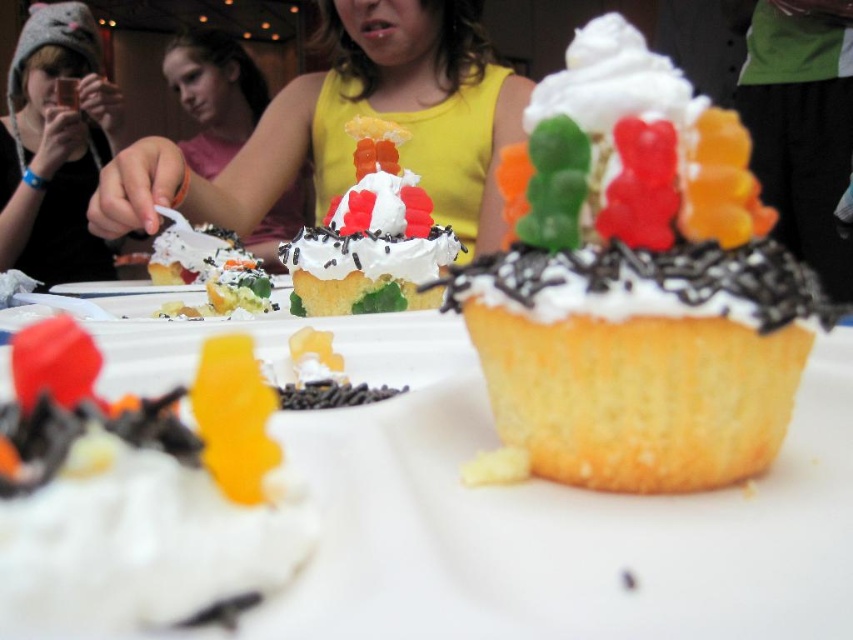
You are standing in front of the cupcake table and want to take a photo. There are two points marked on the table at coordinates point (647, 365) and point (12, 164). Which point is closer to you?

Point (647, 365) is closer to the camera than point (12, 164), so the point closer to you is point (647, 365).

Consider the image. You are standing at point (x=395, y=58) in the scene. You want to take a photo of the cupcakes on the table without moving. Is the camera within your reach?

The distance between point (x=395, y=58) and the camera is 1.98 meters, so the camera is too far away to reach from that point.

You are at the center of the table and want to grab the yellow cake with chocolate sprinkles at center. Which direction should you move to reach it?

The yellow cake with chocolate sprinkles at center is located at point 0.442 on the x and 0.747 on the y coordinates, so you should move towards the lower right direction from the center to reach it.